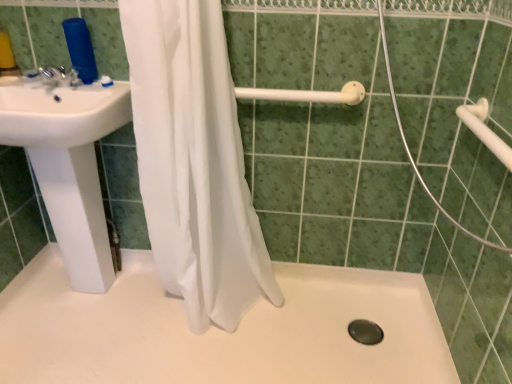
The width and height of the screenshot is (512, 384). I want to click on free area in between white sheer curtain at center and black rubber drain at bottom center, so click(311, 322).